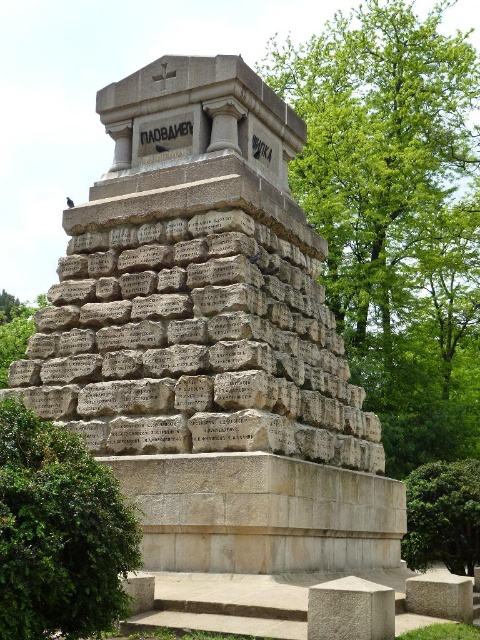
Based on the photo, measure the distance between point [79,380] and camera.

The distance of point [79,380] from camera is 40.27 meters.

From the picture: Does granite stone monument at center have a greater height compared to green leafy bush at lower left?

Yes, granite stone monument at center is taller than green leafy bush at lower left.

Locate an element on the screen. granite stone monument at center is located at coordinates (211, 337).

Find the location of a particular element. Image resolution: width=480 pixels, height=640 pixels. granite stone monument at center is located at coordinates (211, 337).

Is granite stone monument at center below green leafy tree at lower right?

No.

Describe the element at coordinates (211, 337) in the screenshot. I see `granite stone monument at center` at that location.

Measure the distance between point [245,369] and camera.

A distance of 119.71 feet exists between point [245,369] and camera.

Locate an element on the screen. granite stone monument at center is located at coordinates (211, 337).

Is green leafy bush at lower left above green leafy tree at lower right?

Correct, green leafy bush at lower left is located above green leafy tree at lower right.

Is green leafy bush at lower left further to camera compared to green leafy tree at lower right?

No, it is not.

Is point (69, 544) positioned behind point (477, 538)?

No, (69, 544) is closer to viewer.

The image size is (480, 640). In order to click on green leafy bush at lower left in this screenshot , I will do `click(60, 532)`.